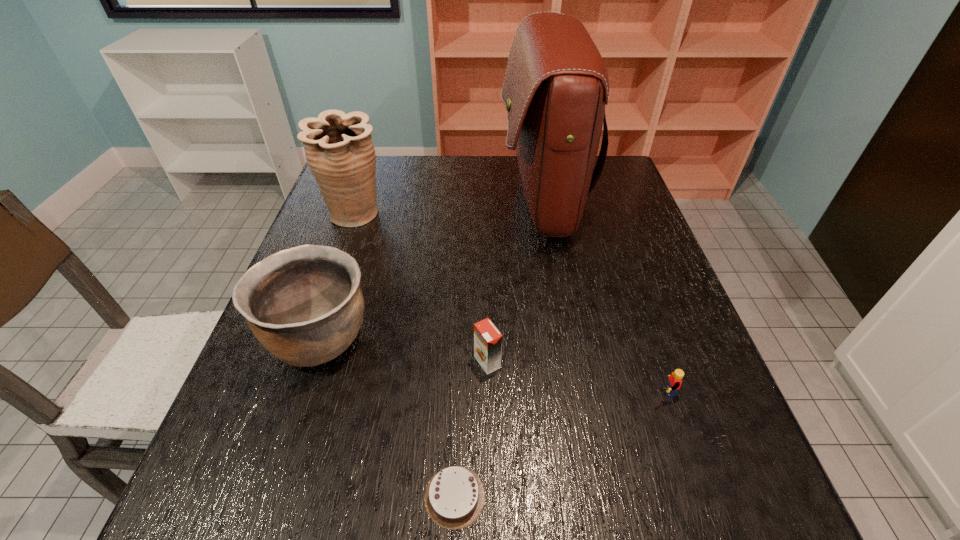
This screenshot has height=540, width=960. I want to click on blank space located 0.100m on the open flap of the tallest object, so click(466, 201).

At what (x,y) coordinates should I click in order to perform the action: click on vacant point located on the right of the urn. Please return your answer as a coordinate pair (x, y). This screenshot has height=540, width=960. Looking at the image, I should click on (474, 214).

Where is `vacant space located 0.130m on the back of the pottery`? vacant space located 0.130m on the back of the pottery is located at coordinates (345, 261).

Identify the location of free spot located on the left of the orange juice. (364, 362).

Image resolution: width=960 pixels, height=540 pixels. In order to click on vacant space positioned on the front-facing side of the Lego in this screenshot , I will do `click(535, 392)`.

What are the coordinates of `vacant space situated on the front-facing side of the Lego` in the screenshot? It's located at (445, 392).

The image size is (960, 540). Identify the location of vacant space situated 0.220m on the front-facing side of the Lego. (530, 392).

The image size is (960, 540). In order to click on vacant space located 0.390m on the back of the shortest object in this screenshot , I will do `click(463, 296)`.

At what (x,y) coordinates should I click in order to perform the action: click on satchel present at the far edge. Please return your answer as a coordinate pair (x, y). The height and width of the screenshot is (540, 960). Looking at the image, I should click on (556, 85).

This screenshot has width=960, height=540. I want to click on urn located at the far edge, so (x=339, y=150).